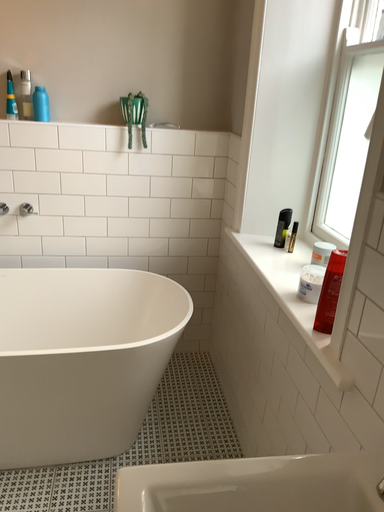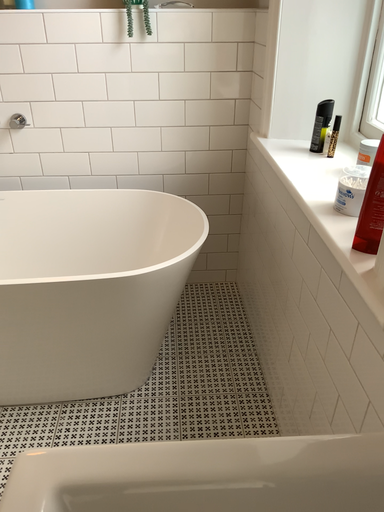
Question: Which way did the camera rotate in the video?

Choices:
 (A) rotated downward
 (B) rotated upward

Answer: (A)